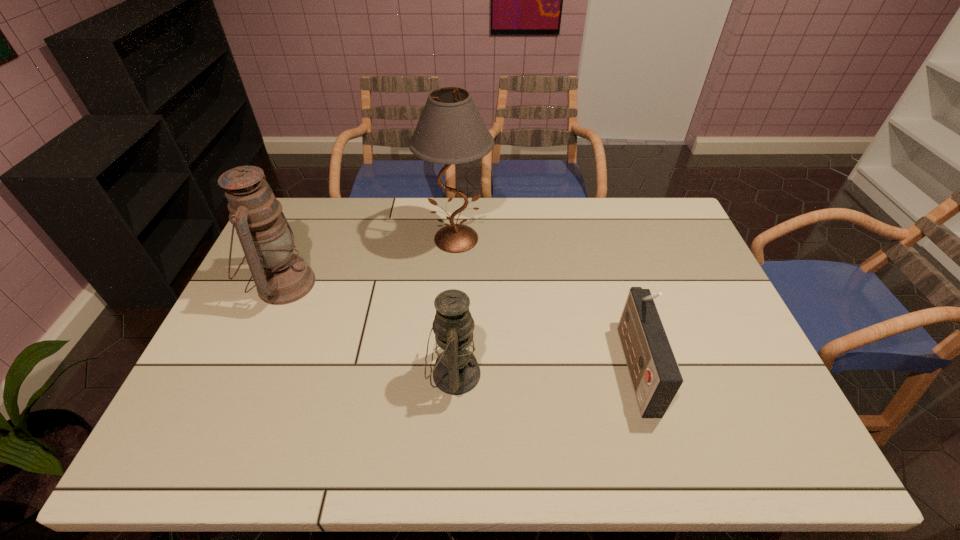
Identify the location of the tallest object. This screenshot has height=540, width=960. (450, 130).

This screenshot has width=960, height=540. Identify the location of the taller oil lamp. (281, 277).

The height and width of the screenshot is (540, 960). Identify the location of the farther oil lamp. (281, 277).

Where is `the right oil lamp`? The width and height of the screenshot is (960, 540). the right oil lamp is located at coordinates (456, 371).

This screenshot has height=540, width=960. In order to click on the nearer oil lamp in this screenshot , I will do `click(456, 371)`.

Identify the location of radio receiver. The height and width of the screenshot is (540, 960). 656,378.

Where is `vacant space situated 0.150m on the front-facing side of the tallest object`? The height and width of the screenshot is (540, 960). vacant space situated 0.150m on the front-facing side of the tallest object is located at coordinates (453, 298).

What are the coordinates of `free space located 0.070m on the back of the third shortest object` in the screenshot? It's located at (302, 242).

This screenshot has height=540, width=960. What are the coordinates of `free space located 0.200m on the right of the right oil lamp` in the screenshot? It's located at (558, 374).

Identify the location of free space located 0.120m on the front panel of the radio receiver. (578, 365).